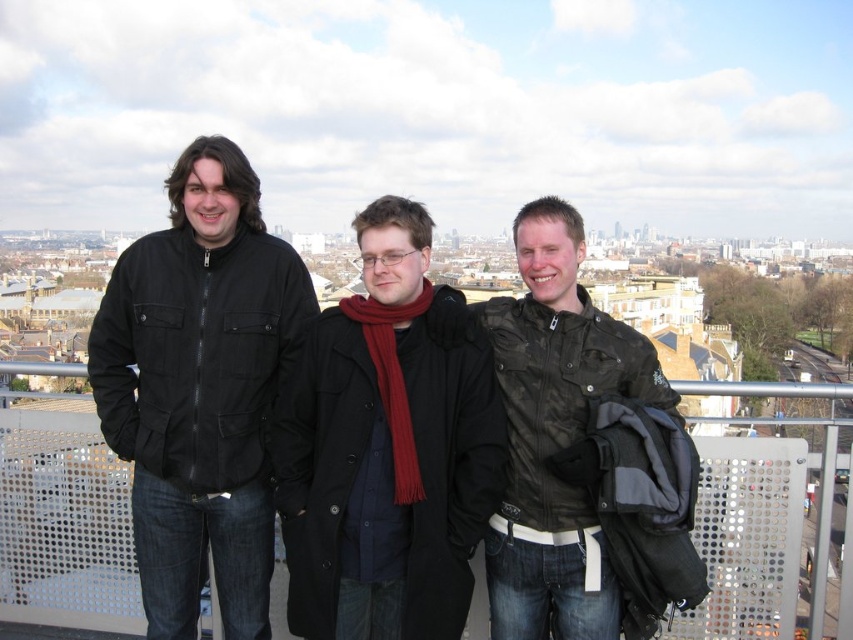
Is matte black coat at center thinner than black matte jacket at left?

Yes, matte black coat at center is thinner than black matte jacket at left.

The image size is (853, 640). What do you see at coordinates (387, 448) in the screenshot?
I see `matte black coat at center` at bounding box center [387, 448].

Which is behind, point (352, 632) or point (259, 381)?

The point (259, 381) is more distant.

This screenshot has width=853, height=640. Identify the location of matte black coat at center. (387, 448).

Can you confirm if black matte jacket at left is shorter than camouflage jacket at center?

No.

Is point (152, 266) farther from camera compared to point (622, 381)?

Yes, it is.

This screenshot has width=853, height=640. I want to click on black matte jacket at left, so coord(200,388).

Does point (479, 420) come behind point (474, 310)?

No, it is not.

How much distance is there between matte black coat at center and camouflage jacket at center?

7.40 meters

Which is in front, point (293, 384) or point (584, 611)?

Positioned in front is point (584, 611).

This screenshot has height=640, width=853. I want to click on matte black coat at center, so click(387, 448).